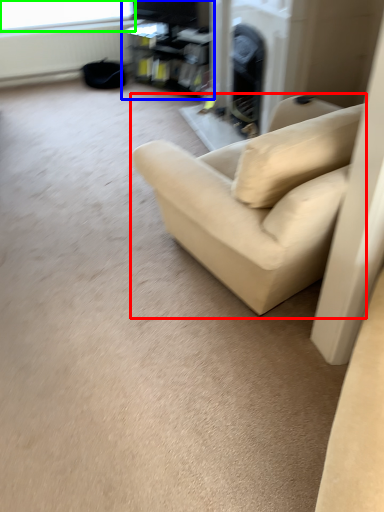
Question: Which is farther away from studio couch (highlighted by a red box)? entertainment center (highlighted by a blue box) or window screen (highlighted by a green box)?

Choices:
 (A) entertainment center
 (B) window screen

Answer: (B)